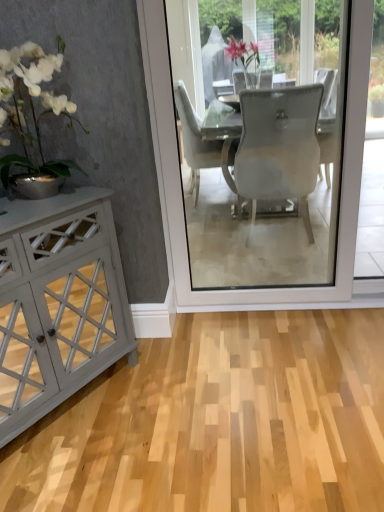
Question: Is matte gray cabinet at left outside of transparent glass screen door at center?

Choices:
 (A) yes
 (B) no

Answer: (A)

Question: Is matte gray cabinet at left beside transparent glass screen door at center?

Choices:
 (A) no
 (B) yes

Answer: (A)

Question: From a real-world perspective, is matte gray cabinet at left located higher than transparent glass screen door at center?

Choices:
 (A) no
 (B) yes

Answer: (B)

Question: Is matte gray cabinet at left oriented away from transparent glass screen door at center?

Choices:
 (A) yes
 (B) no

Answer: (B)

Question: Considering the relative positions of matte gray cabinet at left and transparent glass screen door at center in the image provided, is matte gray cabinet at left to the right of transparent glass screen door at center from the viewer's perspective?

Choices:
 (A) no
 (B) yes

Answer: (A)

Question: Relative to matte gray cabinet at left, is transparent glass screen door at center in front or behind?

Choices:
 (A) front
 (B) behind

Answer: (B)

Question: Considering the positions of transparent glass screen door at center and matte gray cabinet at left in the image, is transparent glass screen door at center wider or thinner than matte gray cabinet at left?

Choices:
 (A) wide
 (B) thin

Answer: (A)

Question: Do you think transparent glass screen door at center is within matte gray cabinet at left, or outside of it?

Choices:
 (A) outside
 (B) inside

Answer: (A)

Question: Considering the positions of transparent glass screen door at center and matte gray cabinet at left in the image, is transparent glass screen door at center taller or shorter than matte gray cabinet at left?

Choices:
 (A) tall
 (B) short

Answer: (B)

Question: In terms of height, does white glossy vase at left look taller or shorter compared to transparent glass screen door at center?

Choices:
 (A) tall
 (B) short

Answer: (A)

Question: Is white glossy vase at left spatially inside transparent glass screen door at center, or outside of it?

Choices:
 (A) inside
 (B) outside

Answer: (B)

Question: Is point (38, 165) closer or farther from the camera than point (337, 262)?

Choices:
 (A) closer
 (B) farther

Answer: (A)

Question: Considering the positions of white glossy vase at left and transparent glass screen door at center in the image, is white glossy vase at left wider or thinner than transparent glass screen door at center?

Choices:
 (A) thin
 (B) wide

Answer: (A)

Question: From the image's perspective, is matte gray cabinet at left above or below transparent glass screen door at center?

Choices:
 (A) above
 (B) below

Answer: (B)

Question: Is point (48, 399) closer or farther from the camera than point (182, 226)?

Choices:
 (A) farther
 (B) closer

Answer: (B)